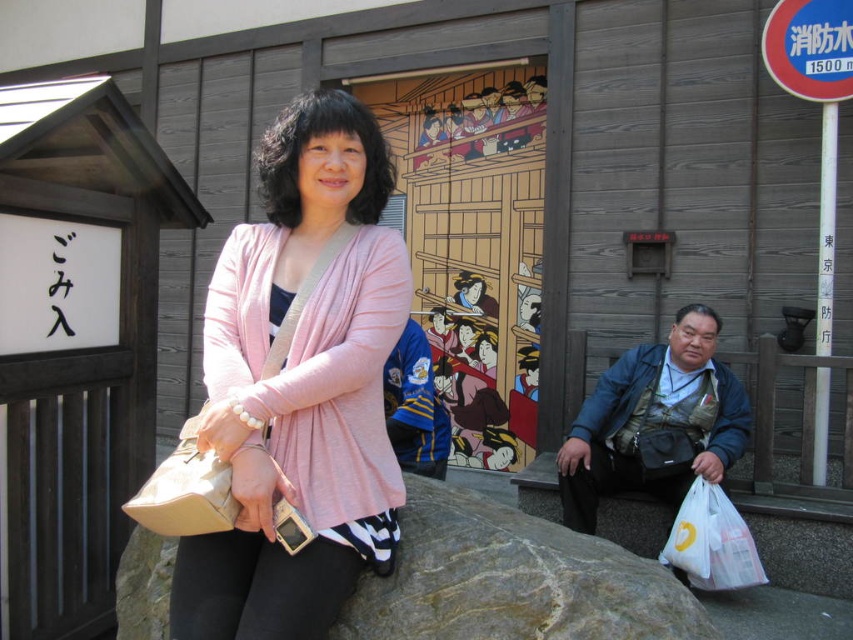
You are standing in front of the wooden building and see the pink fabric sweater at center and the gray rough stone at center. Which object is positioned to the right side?

The gray rough stone at center is positioned to the right of the pink fabric sweater at center.

You are standing in the outdoor scene and want to pick up the white plastic bag at lower right. Is the pink fabric sweater at center blocking your path to it?

The pink fabric sweater at center is in front of the white plastic bag at lower right, so it is blocking the path to the white plastic bag at lower right.

You are standing in front of the wooden building and want to determine which of the two points, point (229, 604) or point (712, 506), is nearer to you. Based on the scene description, which point is closer?

Point (229, 604) is closer to the viewer than point (712, 506).